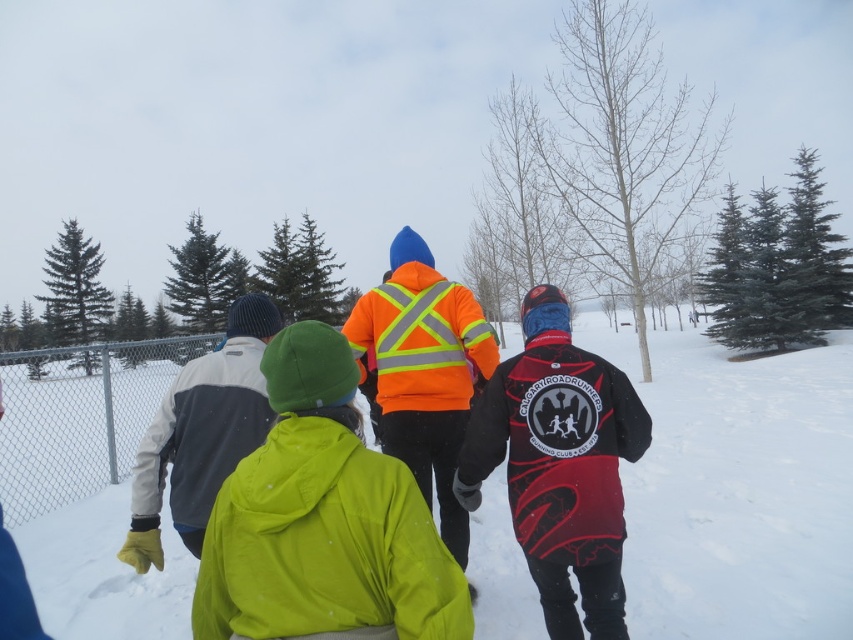
You are standing in the snowy landscape and want to place a small flag exactly at the center of the white fluffy snow at center. According to the coordinates provided, where should you place the flag?

You should place the flag at the coordinates point (x=737, y=488) as that is the 2D location of the white fluffy snow at center.

In the scene shown: You are standing in the snowy landscape and want to take a photo of the group of four individuals walking away from you. The white fluffy snow at center is 3.28 meters away from you. If your camera has a maximum focus range of 3 meters, will you be able to clearly capture the group in your photo?

The white fluffy snow at center is 3.28 meters away from the viewer, which exceeds the camera maximum focus range of 3 meters. Therefore, the group will not be clearly captured in the photo.